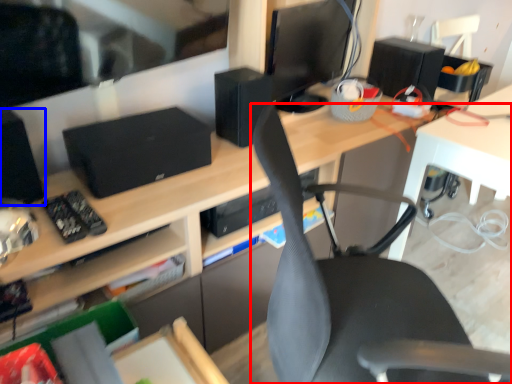
Question: Which point is further to the camera, chair (highlighted by a red box) or speaker (highlighted by a blue box)?

Choices:
 (A) chair
 (B) speaker

Answer: (B)